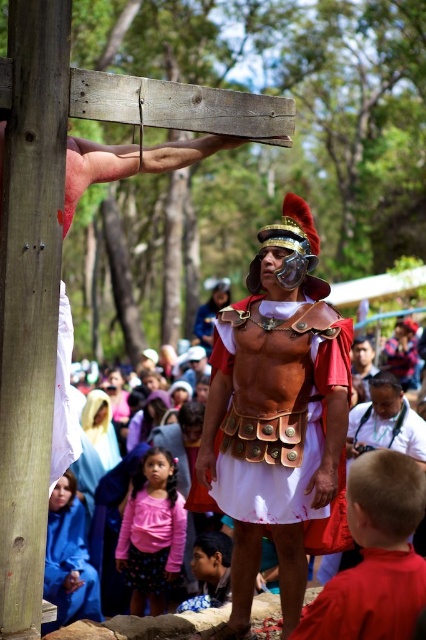
Question: Can you confirm if matte gold armor at center is smaller than blue cotton robe at lower left?

Choices:
 (A) yes
 (B) no

Answer: (A)

Question: Which point is closer to the camera?

Choices:
 (A) smooth wood post at left
 (B) blue cotton robe at lower left

Answer: (A)

Question: Is matte white robe at center thinner than blue cotton robe at lower left?

Choices:
 (A) yes
 (B) no

Answer: (B)

Question: Which object appears farthest from the camera in this image?

Choices:
 (A) blue cotton robe at lower left
 (B) red fabric shirt at lower right
 (C) matte white robe at center

Answer: (A)

Question: Which of these objects is positioned closest to the pink fabric shirt at center?

Choices:
 (A) blue cotton robe at lower left
 (B) matte gold armor at center
 (C) red fabric shirt at lower right
 (D) smooth wood post at left

Answer: (A)

Question: Can you confirm if smooth wood post at left is thinner than pink fabric shirt at center?

Choices:
 (A) yes
 (B) no

Answer: (A)